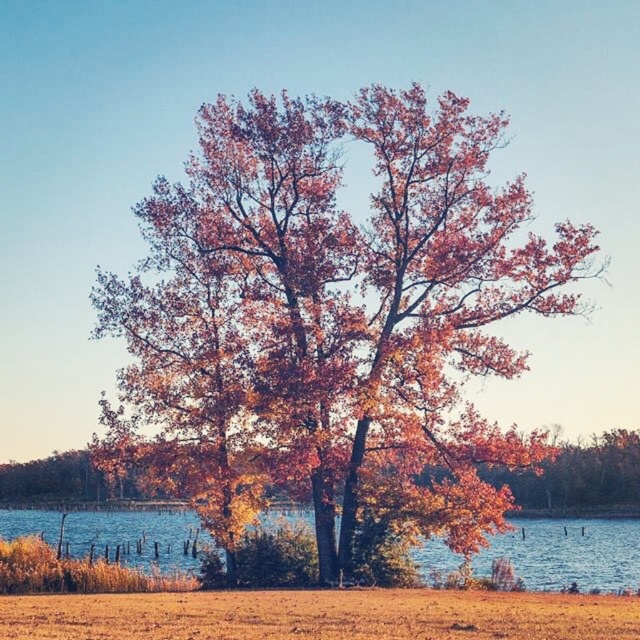
Between brown grass at lower center and blue water at lower center, which one appears on the left side from the viewer's perspective?

From the viewer's perspective, blue water at lower center appears more on the left side.

Between brown grass at lower center and blue water at lower center, which one has more height?

blue water at lower center

Identify the location of brown grass at lower center. The height and width of the screenshot is (640, 640). (321, 616).

Is point (296, 323) positioned behind point (540, 525)?

That is False.

Is autumn leaves wood at center above blue water at lower center?

Yes.

Who is more distant from viewer, (310, 467) or (29, 516)?

Point (29, 516)

The width and height of the screenshot is (640, 640). I want to click on autumn leaves wood at center, so click(x=332, y=321).

Who is more distant from viewer, (304, 161) or (20, 625)?

The point (304, 161) is more distant.

At what (x,y) coordinates should I click in order to perform the action: click on autumn leaves wood at center. Please return your answer as a coordinate pair (x, y). Looking at the image, I should click on (332, 321).